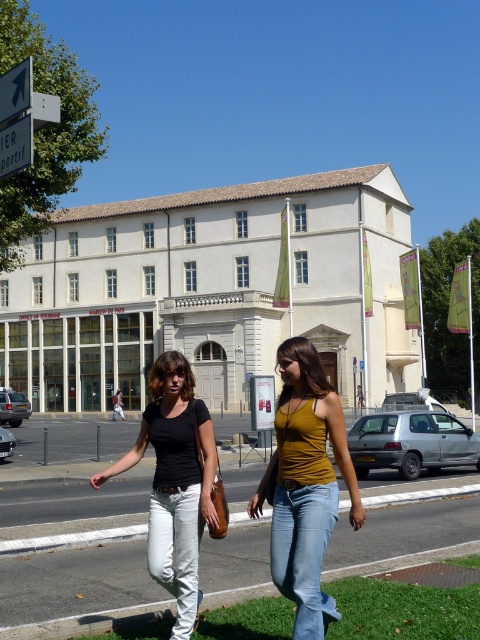
Is point (316, 524) positioned behind point (17, 76)?

That is False.

Who is lower down, blue denim jeans at lower center or white plastic arrow at upper left?

Positioned lower is blue denim jeans at lower center.

Describe the element at coordinates (303, 552) in the screenshot. I see `blue denim jeans at lower center` at that location.

Where is `blue denim jeans at lower center`? The width and height of the screenshot is (480, 640). blue denim jeans at lower center is located at coordinates (303, 552).

Who is more forward, (299,422) or (158,550)?

Point (299,422) is in front.

Does mustard yellow tank top at center appear over matte black shirt at center?

Yes, mustard yellow tank top at center is above matte black shirt at center.

I want to click on mustard yellow tank top at center, so click(x=304, y=484).

The height and width of the screenshot is (640, 480). What are the coordinates of `mustard yellow tank top at center` in the screenshot? It's located at (304, 484).

Between blue denim jeans at lower center and white plastic sign at upper left, which one has more height?

blue denim jeans at lower center

Which is behind, point (276, 556) or point (0, 170)?

Positioned behind is point (0, 170).

The width and height of the screenshot is (480, 640). Identify the location of blue denim jeans at lower center. (303, 552).